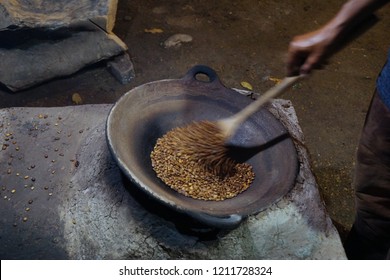
At what (x,y) coordinates should I click in order to perform the action: click on shadow of pan handle. Please return your answer as a coordinate pair (x, y). This screenshot has height=280, width=390. Looking at the image, I should click on (192, 234).